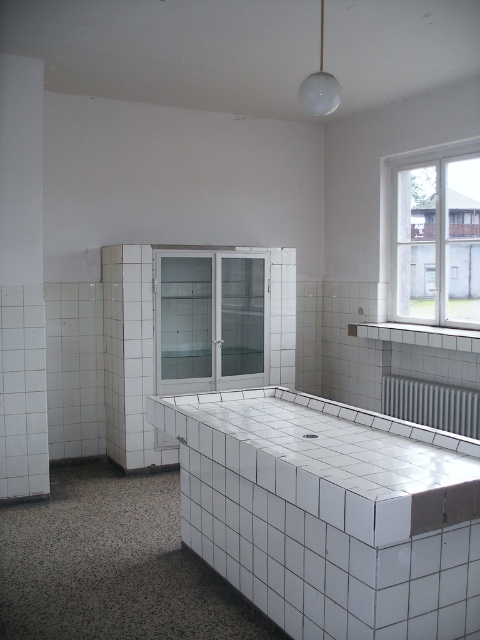
Question: Which object is positioned farthest from the white metallic radiator at lower right?

Choices:
 (A) white glass cabinet at center
 (B) transparent glass window at upper right

Answer: (B)

Question: Can you confirm if transparent glass window at upper right is positioned to the left of white glass cabinet at center?

Choices:
 (A) no
 (B) yes

Answer: (A)

Question: Can you confirm if white tile counter top at center is positioned to the left of transparent glass window at upper right?

Choices:
 (A) no
 (B) yes

Answer: (B)

Question: Which point appears farthest from the camera in this image?

Choices:
 (A) (398, 284)
 (B) (439, 385)
 (C) (216, 342)
 (D) (325, 460)

Answer: (A)

Question: Based on their relative distances, which object is farther from the white metallic radiator at lower right?

Choices:
 (A) white glass cabinet at center
 (B) white tile counter top at center

Answer: (B)

Question: Is white tile counter top at center below white glass cabinet at center?

Choices:
 (A) no
 (B) yes

Answer: (B)